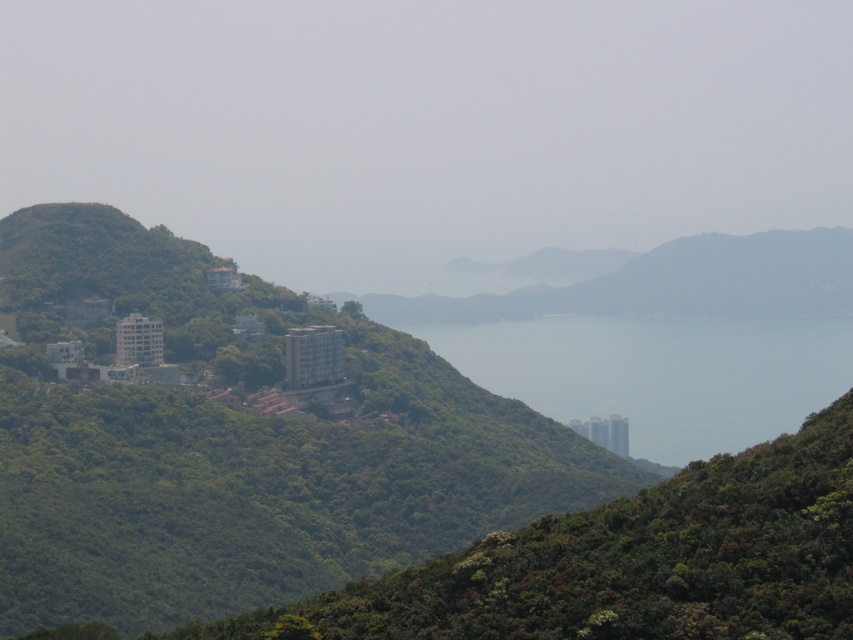
Is green leafy hillside at center wider than green leafy mountain at center?

Yes.

Is point (410, 360) positioned behind point (840, 300)?

No, it is in front of (840, 300).

Where is `green leafy hillside at center`? Image resolution: width=853 pixels, height=640 pixels. green leafy hillside at center is located at coordinates (235, 444).

Does transparent blue water at center have a greater width compared to green leafy mountain at center?

No.

Which is more to the left, transparent blue water at center or green leafy mountain at center?

From the viewer's perspective, green leafy mountain at center appears more on the left side.

Does point (445, 324) come in front of point (631, 259)?

Yes, point (445, 324) is closer to viewer.

At what (x,y) coordinates should I click in order to perform the action: click on transparent blue water at center. Please return your answer as a coordinate pair (x, y). The height and width of the screenshot is (640, 853). Looking at the image, I should click on (660, 372).

Between green leafy hillside at center and transparent blue water at center, which one appears on the left side from the viewer's perspective?

green leafy hillside at center

Consider the image. Between green leafy hillside at center and transparent blue water at center, which one has more height?

green leafy hillside at center is taller.

Which is in front, point (48, 504) or point (434, 332)?

Point (48, 504)

Where is `green leafy hillside at center`? green leafy hillside at center is located at coordinates (235, 444).